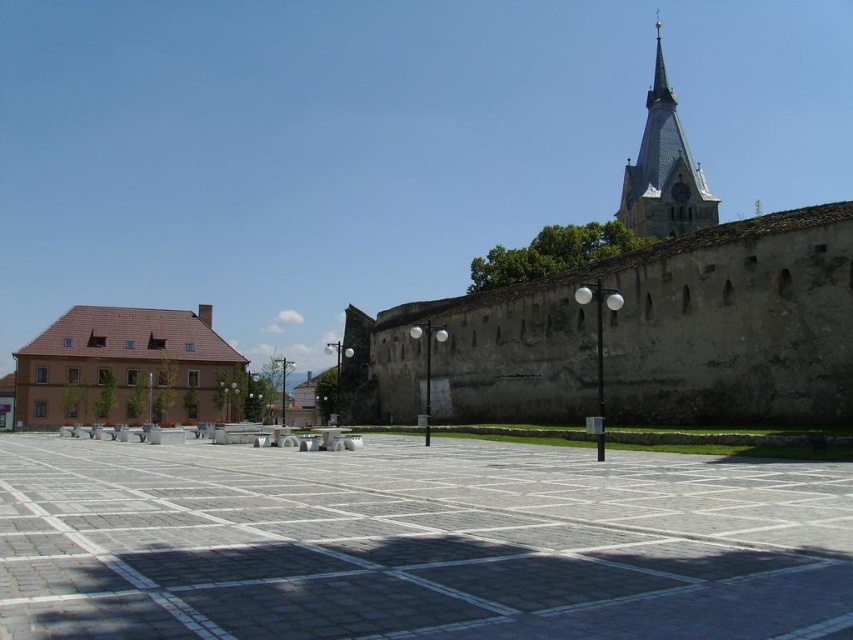
You are standing at the center of the plaza and want to walk towards the two points marked in the image. Which point, point (375, 540) or point (234, 358), will you reach first?

Point (375, 540) is closer to the camera than point (234, 358). Since you are standing at the center of the plaza, you will reach point (375, 540) first because it is closer to your starting position.

You are standing in the plaza and want to take a photo of the light brown stone clock tower at upper right. However, there are gray concrete tiles at center in the way. Can you move to the side to avoid them?

The gray concrete tiles at center are closer to the viewer than the light brown stone clock tower at upper right, so you can move to the side to avoid them and still see the light brown stone clock tower at upper right.